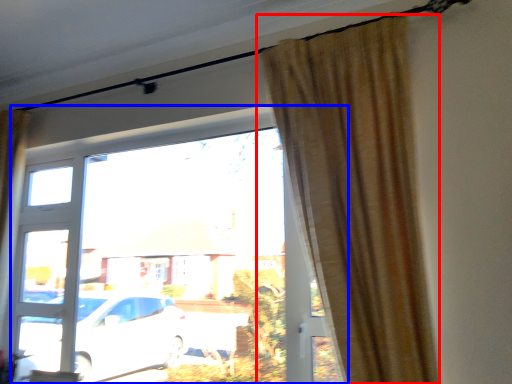
Question: Among these objects, which one is farthest to the camera, curtain (highlighted by a red box) or window (highlighted by a blue box)?

Choices:
 (A) curtain
 (B) window

Answer: (B)